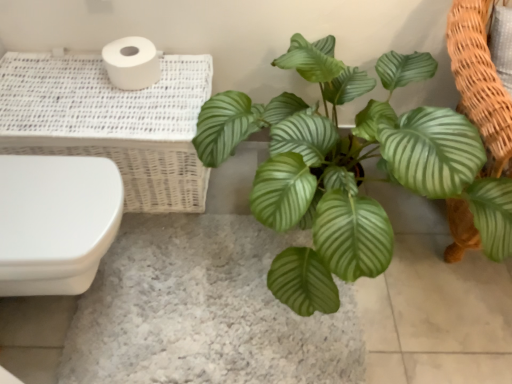
This screenshot has width=512, height=384. Identify the location of green glossy leafy plant at center. (350, 169).

The height and width of the screenshot is (384, 512). Describe the element at coordinates (131, 63) in the screenshot. I see `white matte toilet paper at upper left` at that location.

Locate an element on the screen. This screenshot has height=384, width=512. white wicker basket at upper left is located at coordinates (111, 122).

Between point (61, 98) and point (140, 64), which one is positioned in front?

Positioned in front is point (61, 98).

From the image's perspective, is white wicker basket at upper left under white matte toilet paper at upper left?

Yes, from the image's perspective, white wicker basket at upper left is beneath white matte toilet paper at upper left.

Does white wicker basket at upper left turn towards white matte toilet paper at upper left?

No, white wicker basket at upper left is not facing towards white matte toilet paper at upper left.

Considering the sizes of objects white wicker basket at upper left and white matte toilet paper at upper left in the image provided, who is thinner, white wicker basket at upper left or white matte toilet paper at upper left?

With smaller width is white matte toilet paper at upper left.

From a real-world perspective, is white wicker basket at upper left above or below green leafy plant at center?

Clearly, from a real-world perspective, white wicker basket at upper left is above green leafy plant at center.

Locate an element on the screen. This screenshot has height=384, width=512. concrete below the white wicker basket at upper left (from a real-world perspective) is located at coordinates (204, 310).

Can you confirm if white wicker basket at upper left is shorter than green leafy plant at center?

Incorrect, the height of white wicker basket at upper left does not fall short of that of green leafy plant at center.

Considering the relative positions of white wicker basket at upper left and green leafy plant at center in the image provided, is white wicker basket at upper left to the left of green leafy plant at center from the viewer's perspective?

Yes.

Relative to white matte toilet paper at upper left, is green glossy leafy plant at center in front or behind?

Visually, green glossy leafy plant at center is located in front of white matte toilet paper at upper left.

Does point (456, 113) appear closer or farther from the camera than point (121, 44)?

Point (456, 113) appears to be farther away from the viewer than point (121, 44).

Does green glossy leafy plant at center appear on the right side of white matte toilet paper at upper left?

Indeed, green glossy leafy plant at center is positioned on the right side of white matte toilet paper at upper left.

Does green glossy leafy plant at center touch white matte toilet paper at upper left?

No, green glossy leafy plant at center is not with white matte toilet paper at upper left.

Locate an element on the screen. This screenshot has width=512, height=384. houseplant that appears in front of the green leafy plant at center is located at coordinates (350, 169).

How many degrees apart are the facing directions of green glossy leafy plant at center and green leafy plant at center?

There is a 0.235-degree angle between the facing directions of green glossy leafy plant at center and green leafy plant at center.

Is green glossy leafy plant at center facing towards green leafy plant at center?

No, green glossy leafy plant at center is not facing towards green leafy plant at center.

Can white wicker basket at upper left be found inside white glossy toilet at left?

→ No, white wicker basket at upper left is located outside of white glossy toilet at left.

Does point (68, 249) lie behind point (56, 148)?

No.

In terms of size, does white glossy toilet at left appear bigger or smaller than white wicker basket at upper left?

white glossy toilet at left is smaller than white wicker basket at upper left.

From the image's perspective, which is below, green leafy plant at center or white glossy toilet at left?

green leafy plant at center appears lower in the image.

Between green leafy plant at center and white glossy toilet at left, which one has less height?

With less height is green leafy plant at center.

Is green leafy plant at center next to white glossy toilet at left?

No, green leafy plant at center is not making contact with white glossy toilet at left.

Which is nearer, (342, 329) or (27, 157)?

Point (342, 329) appears to be farther away from the viewer than point (27, 157).

Is white glossy toilet at left turned away from green glossy leafy plant at center?

No.

Consider the image. Does white glossy toilet at left have a greater height compared to green glossy leafy plant at center?

Incorrect, the height of white glossy toilet at left is not larger of that of green glossy leafy plant at center.

Which of these two, white glossy toilet at left or green glossy leafy plant at center, is bigger?

With larger size is green glossy leafy plant at center.

Which of these two, white glossy toilet at left or green glossy leafy plant at center, is thinner?

white glossy toilet at left.

Locate an element on the screen. The width and height of the screenshot is (512, 384). basket in front of the white matte toilet paper at upper left is located at coordinates (111, 122).

I want to click on basket above the green leafy plant at center (from a real-world perspective), so click(x=111, y=122).

Which object lies nearer to the anchor point green leafy plant at center, white glossy toilet at left or white wicker basket at upper left?

The object closer to green leafy plant at center is white glossy toilet at left.

When comparing their distances from green leafy plant at center, does white matte toilet paper at upper left or green glossy leafy plant at center seem closer?

green glossy leafy plant at center is closer to green leafy plant at center.

Based on their spatial positions, is white glossy toilet at left or green leafy plant at center further from white wicker basket at upper left?

green leafy plant at center is positioned further to the anchor white wicker basket at upper left.

From the image, which object appears to be farther from green leafy plant at center, green glossy leafy plant at center or white glossy toilet at left?

green glossy leafy plant at center is further to green leafy plant at center.

Considering their positions, is white glossy toilet at left positioned closer to white matte toilet paper at upper left than green leafy plant at center?

white glossy toilet at left is closer to white matte toilet paper at upper left.

When comparing their distances from white matte toilet paper at upper left, does green leafy plant at center or white glossy toilet at left seem further?

The object further to white matte toilet paper at upper left is green leafy plant at center.

Based on their spatial positions, is white matte toilet paper at upper left or white wicker basket at upper left closer to green glossy leafy plant at center?

white wicker basket at upper left is positioned closer to the anchor green glossy leafy plant at center.

Considering their positions, is green glossy leafy plant at center positioned closer to white glossy toilet at left than white matte toilet paper at upper left?

Based on the image, white matte toilet paper at upper left appears to be nearer to white glossy toilet at left.

The image size is (512, 384). I want to click on basket between white glossy toilet at left and green glossy leafy plant at center from left to right, so click(111, 122).

Identify the location of houseplant between white matte toilet paper at upper left and green leafy plant at center from top to bottom. (350, 169).

You are a GUI agent. You are given a task and a screenshot of the screen. Output one action in this format:
    pyautogui.click(x=<x>, y=<y>)
    Task: Click on the basket located between white glossy toilet at left and green leafy plant at center in the left-right direction
    This screenshot has width=512, height=384.
    Given the screenshot: What is the action you would take?
    pyautogui.click(x=111, y=122)

Where is `toilet between white matte toilet paper at upper left and green leafy plant at center from top to bottom`? toilet between white matte toilet paper at upper left and green leafy plant at center from top to bottom is located at coordinates (55, 222).